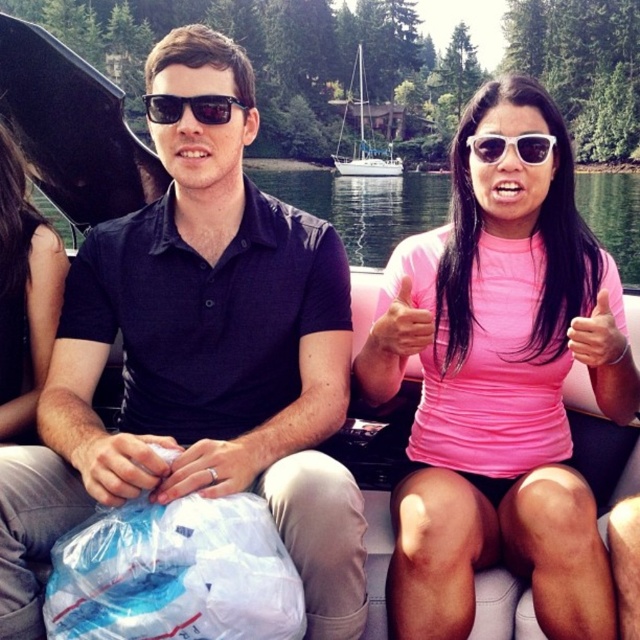
Question: Which object is the farthest from the pink fabric at center?

Choices:
 (A) pink matte shirt at center
 (B) white matte sunglasses at center

Answer: (A)

Question: Which object appears closest to the camera in this image?

Choices:
 (A) pink fabric at center
 (B) white matte sunglasses at center
 (C) black reflective sunglasses at center

Answer: (B)

Question: In this image, where is matte black polo shirt at center located relative to white sailboat at center?

Choices:
 (A) above
 (B) below

Answer: (B)

Question: Which point is closer to the camera?

Choices:
 (A) pink fabric at center
 (B) pink matte shirt at center

Answer: (B)

Question: Can you confirm if smooth black hair at left is thinner than white sailboat at center?

Choices:
 (A) no
 (B) yes

Answer: (B)

Question: Can you confirm if matte black polo shirt at center is positioned to the right of white matte sunglasses at center?

Choices:
 (A) yes
 (B) no

Answer: (B)